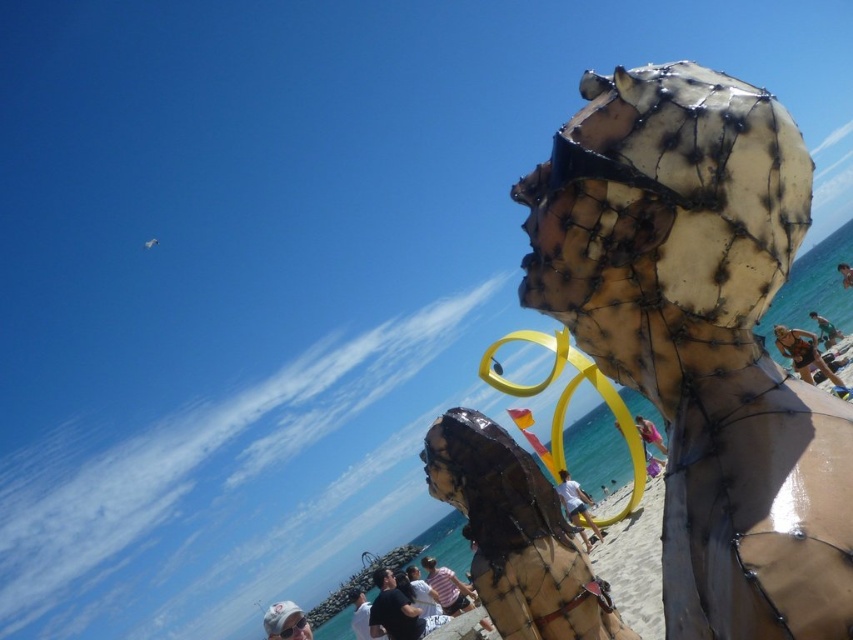
You are standing at the beach scene and want to locate the matte black shirt at center. Which coordinate point should you look at?

You should look at point (x=393, y=609) to find the matte black shirt at center.

Consider the image. You are standing at the edge of the beach looking towards the sculptures. Which object, the rusty metal sculpture at center or the white fabric shirt at lower center, is positioned to the right from your viewpoint?

The rusty metal sculpture at center is to the right of the white fabric shirt at lower center, so from your viewpoint, the rusty metal sculpture at center is positioned to the right.